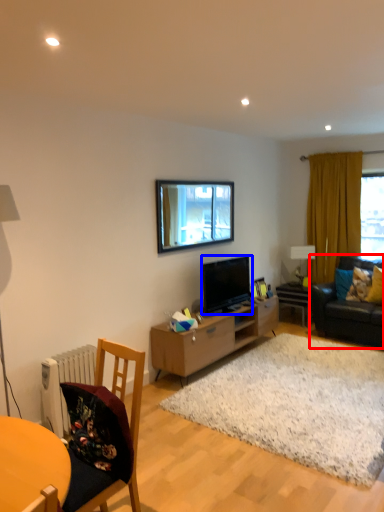
Question: Which of the following is the farthest to the observer, studio couch (highlighted by a red box) or television (highlighted by a blue box)?

Choices:
 (A) studio couch
 (B) television

Answer: (A)